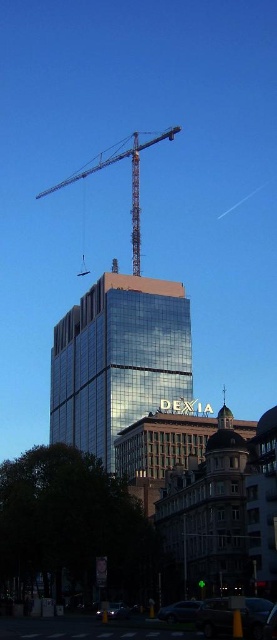
You are a photographer trying to capture both the metallic silver car at lower right and the shiny black car at lower center in a single shot. Which car should you position closer to the camera to ensure both are fully visible in the frame?

To ensure both the metallic silver car at lower right and the shiny black car at lower center are fully visible, you should position the metallic silver car at lower right closer to the camera since it is shorter than the shiny black car at lower center. This way, the taller shiny black car at lower center can be accommodated without cropping either vehicle.

You are an architect reviewing the urban layout. The shiny glass tower at center and the metallic gray crane at upper center are both part of the construction site. Which object takes up more area in the image?

The metallic gray crane at upper center occupies more space than the shiny glass tower at center, so it takes up more area in the image.

You are standing in the urban scene looking at the DEXIA skyscraper. There are two points marked on the image. The first point is at coordinates point (x=73, y=177) and the second point is at point (x=188, y=605). Which point is closer to your eyes?

Point (x=73, y=177) is further to the camera than point (x=188, y=605), so the point closer to your eyes is point (x=188, y=605).